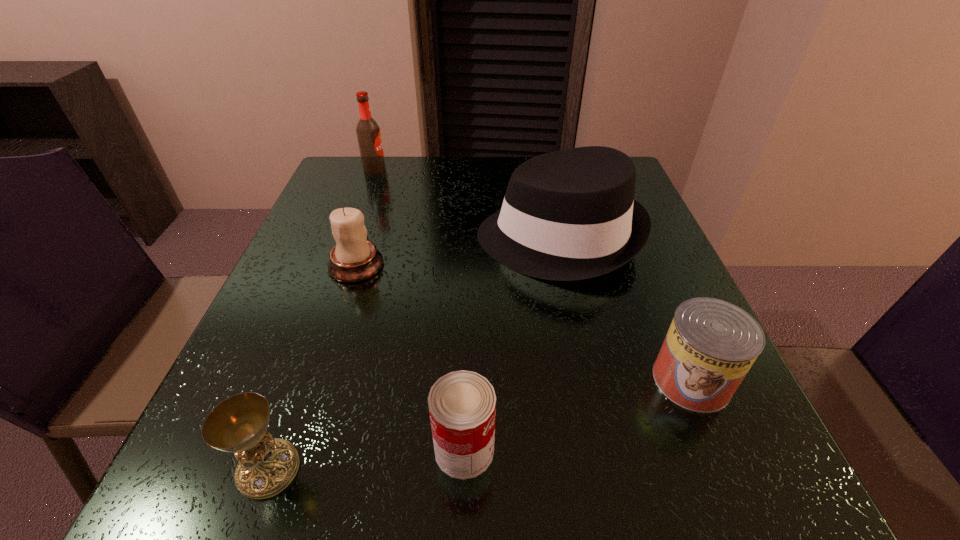
Where is `vacant position located 0.050m on the front of the right can`? The image size is (960, 540). vacant position located 0.050m on the front of the right can is located at coordinates (719, 446).

Where is `vacant region located on the front label of the nearer can`? This screenshot has height=540, width=960. vacant region located on the front label of the nearer can is located at coordinates (596, 449).

Locate an element on the screen. The height and width of the screenshot is (540, 960). vacant area located on the back of the chalice is located at coordinates (336, 282).

The image size is (960, 540). I want to click on beer bottle present at the far edge, so click(x=368, y=133).

This screenshot has width=960, height=540. Find the location of `fedora at the far edge`. fedora at the far edge is located at coordinates (567, 215).

In order to click on can located in the near edge section of the desktop in this screenshot , I will do `click(462, 405)`.

This screenshot has width=960, height=540. I want to click on chalice at the near edge, so click(x=267, y=465).

This screenshot has width=960, height=540. Identify the location of beer bottle located at the left edge. (368, 133).

Find the location of a particular element. candle holder that is at the left edge is located at coordinates (353, 259).

Identify the location of chalice present at the left edge. [x=267, y=465].